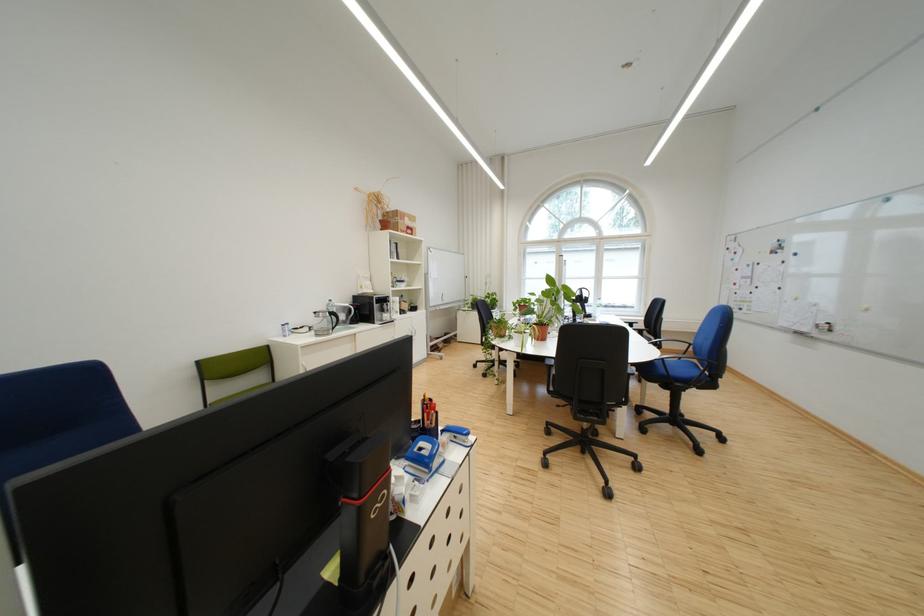
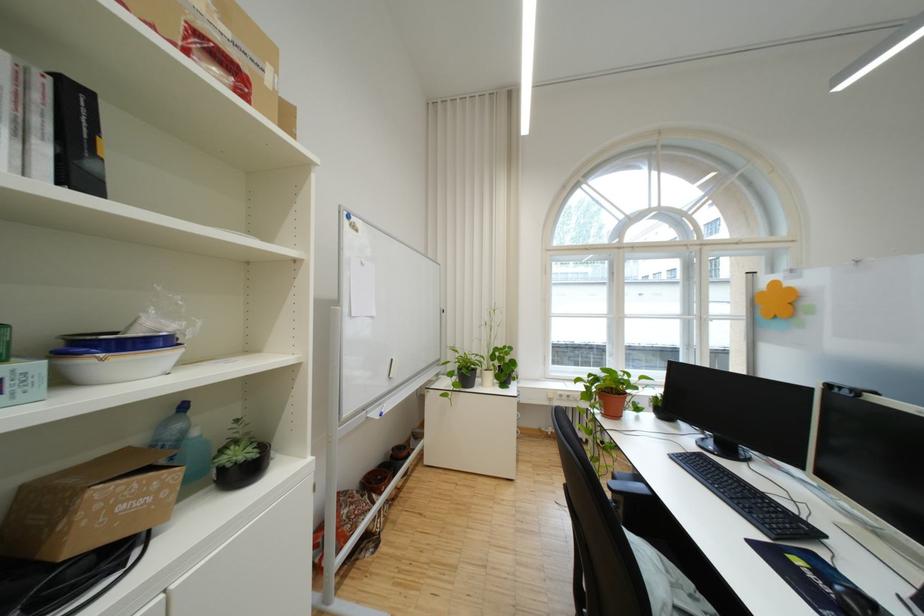
Question: Which direction would the cameraman need to move to produce the second image? Reply with the corresponding letter.

Choices:
 (A) Left
 (B) Right
 (C) Forward
 (D) Backward

Answer: (C)